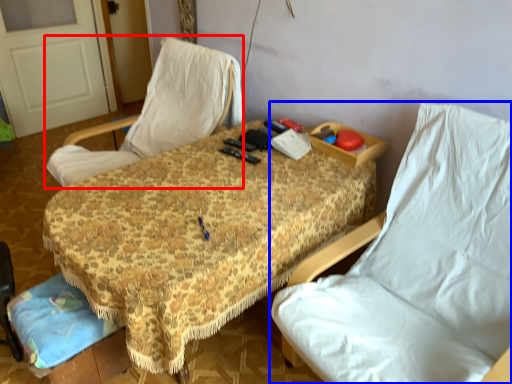
Question: Which of the following is the farthest to the observer, chair (highlighted by a red box) or chair (highlighted by a blue box)?

Choices:
 (A) chair
 (B) chair

Answer: (A)